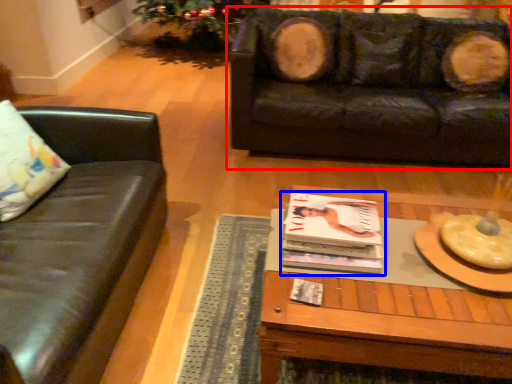
Question: Among these objects, which one is nearest to the camera, studio couch (highlighted by a red box) or magazine (highlighted by a blue box)?

Choices:
 (A) studio couch
 (B) magazine

Answer: (B)